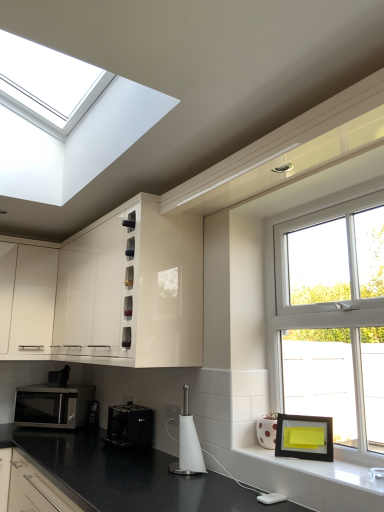
I want to click on empty space that is ontop of white glossy window sill at lower right, so click(x=333, y=465).